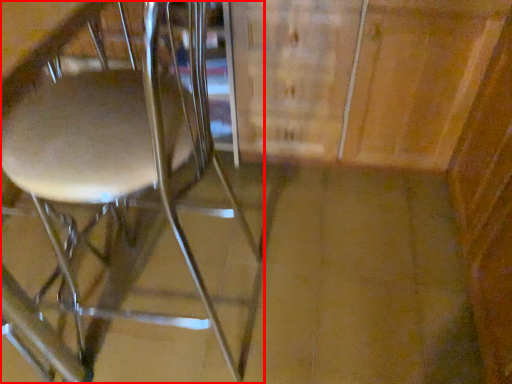
Question: From the image's perspective, what is the correct spatial relationship of chair (annotated by the red box) in relation to cabinetry?

Choices:
 (A) below
 (B) above

Answer: (A)